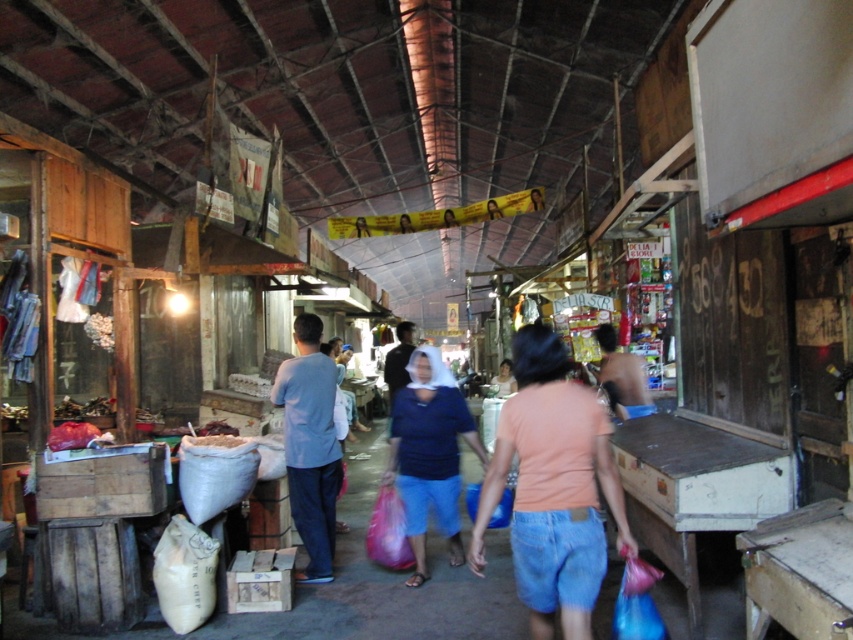
Which is behind, point (425, 388) or point (292, 458)?

The point (425, 388) is more distant.

Does blue cotton shirt at center appear on the left side of light blue fabric shirt at center?

Incorrect, blue cotton shirt at center is not on the left side of light blue fabric shirt at center.

Measure the distance between point (428, 410) and camera.

Point (428, 410) and camera are 18.37 feet apart from each other.

Where is `blue cotton shirt at center`? blue cotton shirt at center is located at coordinates (430, 452).

Is denim shorts at center closer to camera compared to light blue fabric shirt at center?

Yes, it is in front of light blue fabric shirt at center.

Does denim shorts at center have a greater width compared to light blue fabric shirt at center?

Indeed, denim shorts at center has a greater width compared to light blue fabric shirt at center.

At what (x,y) coordinates should I click in order to perform the action: click on denim shorts at center. Please return your answer as a coordinate pair (x, y). Looking at the image, I should click on (552, 486).

Image resolution: width=853 pixels, height=640 pixels. What are the coordinates of `denim shorts at center` in the screenshot? It's located at (552, 486).

Which is in front, point (521, 376) or point (459, 392)?

Point (521, 376)

What are the coordinates of `denim shorts at center` in the screenshot? It's located at (552, 486).